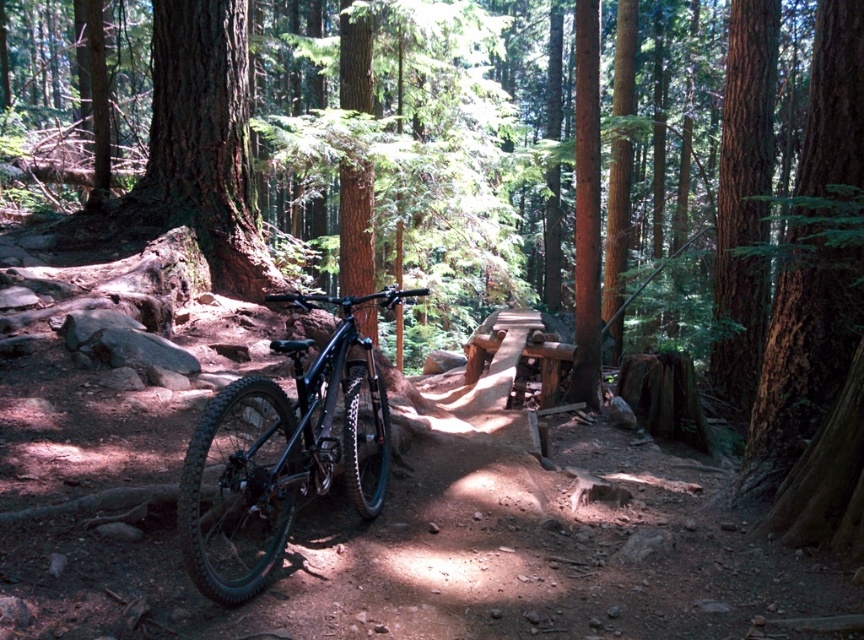
You are a hiker who just arrived at the forest scene. You see a point marked at coordinates (283, 452). Which object is this point located on?

The point marked at coordinates (283, 452) is located on the shiny black mountain bike at center.

You are a hiker trying to find your way back to the trailhead. You notice a shiny black mountain bike at center and a smooth brown bark at right. According to the scene, which object is positioned more to the left?

The shiny black mountain bike at center is positioned to the left of smooth brown bark at right, so the bike is more to the left.

From the picture: You are an adventurer trying to decide whether to ride your bike through the forest. Based on the scene, can you tell if the shiny black mountain bike at center is shorter than the smooth brown bark at right?

The shiny black mountain bike at center is not as tall as smooth brown bark at right, so yes, the bike is shorter than the bark.